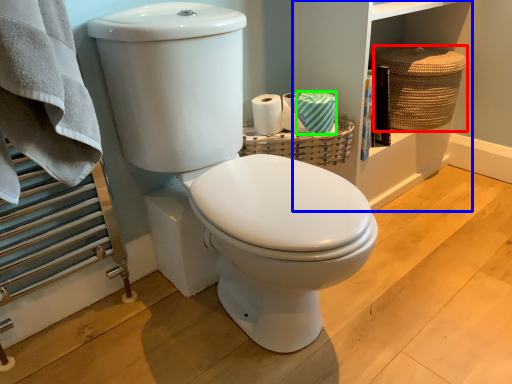
Question: Considering the real-world distances, which object is closest to basket (highlighted by a red box)? bookshelf (highlighted by a blue box) or toilet paper (highlighted by a green box).

Choices:
 (A) bookshelf
 (B) toilet paper

Answer: (A)